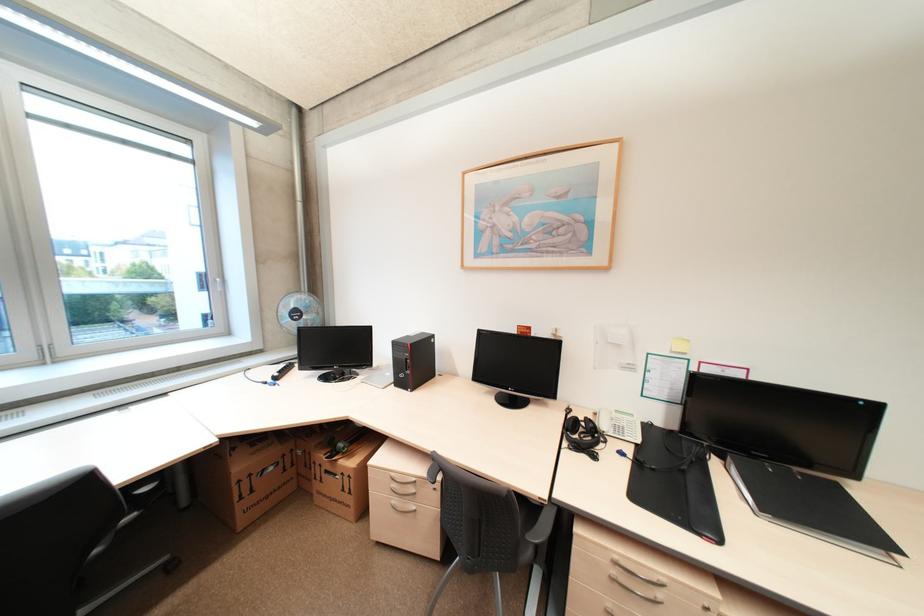
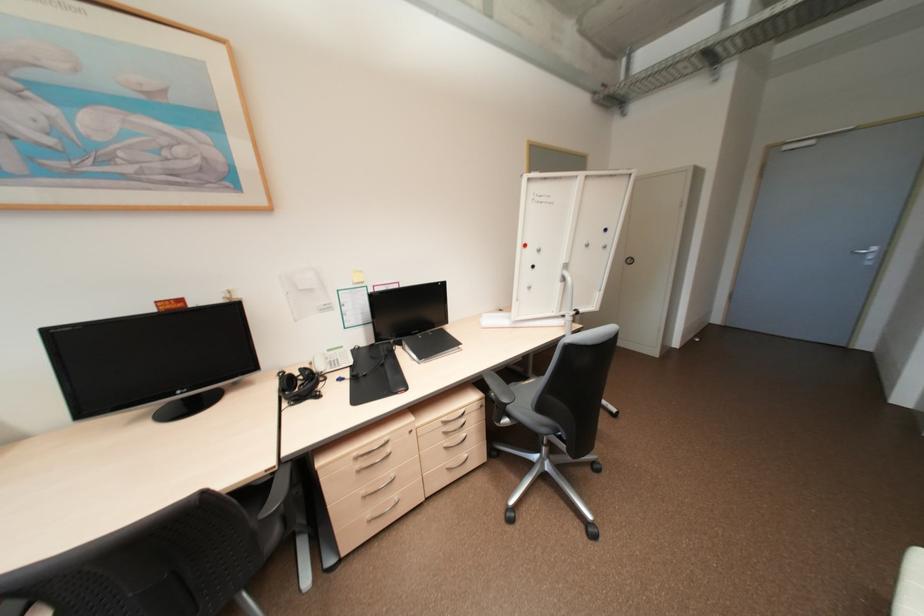
Locate, in the second image, the point that corresponds to point 581,419 in the first image.

(297, 377)